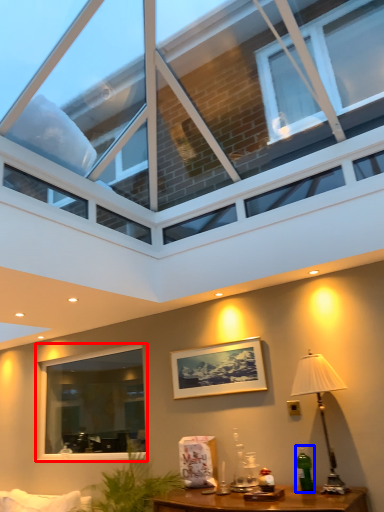
Question: Among these objects, which one is nearest to the camera, window (highlighted by a red box) or bottle (highlighted by a blue box)?

Choices:
 (A) window
 (B) bottle

Answer: (B)